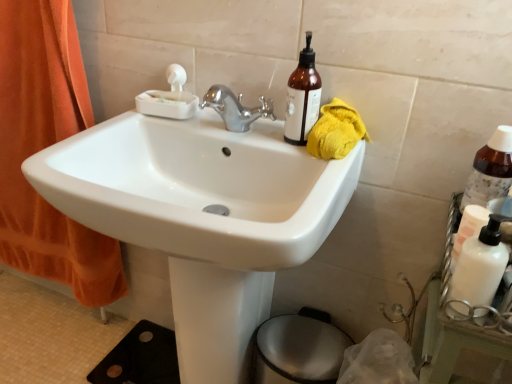
Locate an element on the screen. Image resolution: width=512 pixels, height=384 pixels. free space above metallic silver bidet at lower center (from a real-world perspective) is located at coordinates (306, 345).